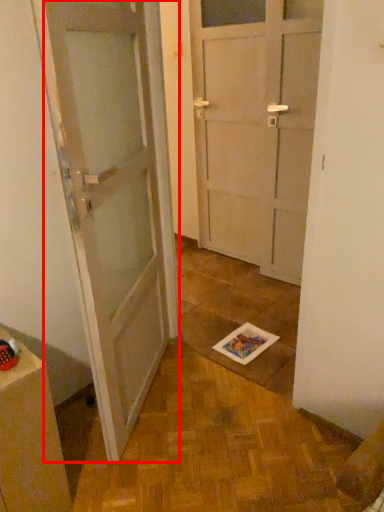
Question: Considering the relative positions of door (annotated by the red box) and cabinetry in the image provided, where is door (annotated by the red box) located with respect to the staircase?

Choices:
 (A) left
 (B) right

Answer: (B)